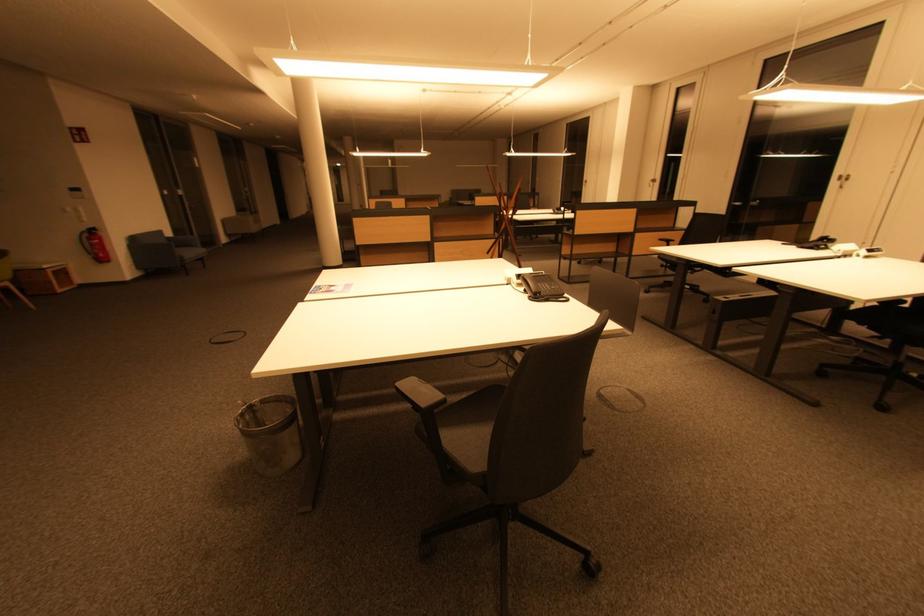
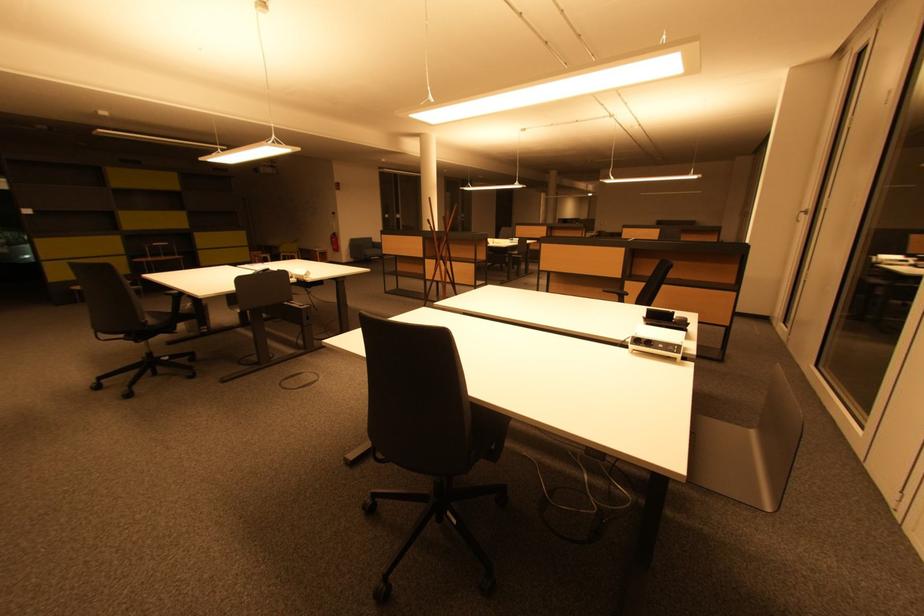
Locate, in the second image, the point that corresponds to (101,244) in the first image.

(338, 241)